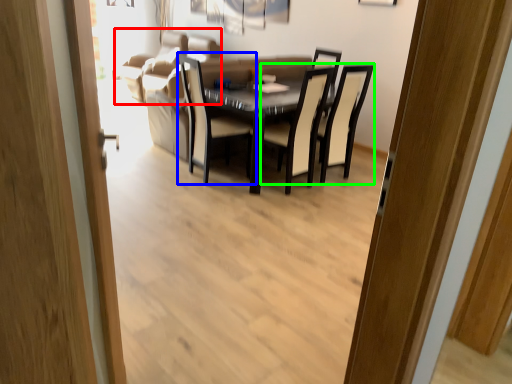
Question: Based on their relative distances, which object is nearer to couch (highlighted by a red box)? Choose from chair (highlighted by a blue box) and chair (highlighted by a green box).

Choices:
 (A) chair
 (B) chair

Answer: (A)